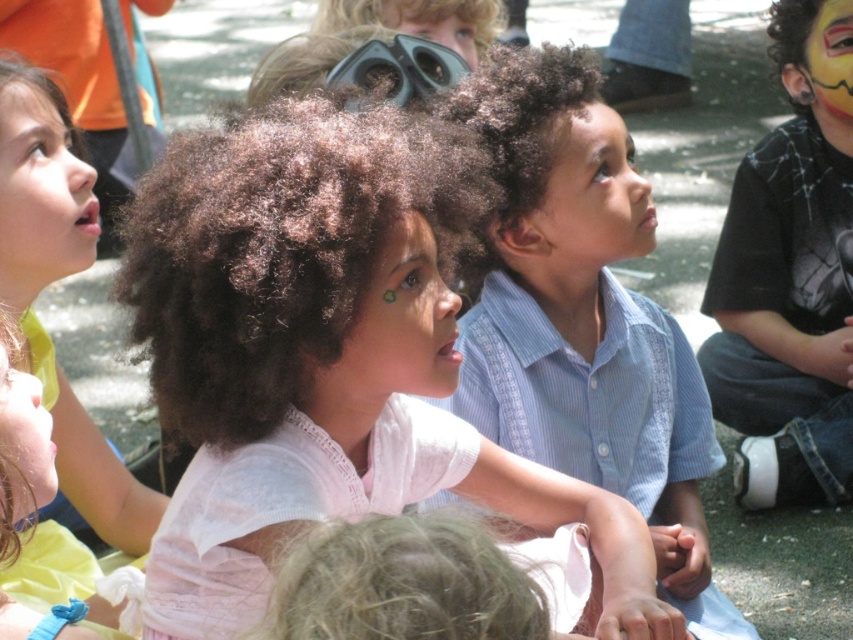
Question: Where is smooth green face at lower left located in relation to painted face at upper right in the image?

Choices:
 (A) below
 (B) above

Answer: (A)

Question: Does white matte shirt at center appear on the right side of matte white face at upper left?

Choices:
 (A) yes
 (B) no

Answer: (A)

Question: Which point appears farthest from the camera in this image?

Choices:
 (A) (521, 442)
 (B) (78, 268)
 (C) (747, 220)

Answer: (C)

Question: Which object appears closest to the camera in this image?

Choices:
 (A) smooth skin face at center
 (B) white matte shirt at center
 (C) blue striped shirt at center

Answer: (B)

Question: Which point is closer to the camera?

Choices:
 (A) (33, 493)
 (B) (817, 100)
 (C) (421, 257)

Answer: (A)

Question: Does matte white face at upper left appear under matte black binoculars at upper center?

Choices:
 (A) yes
 (B) no

Answer: (A)